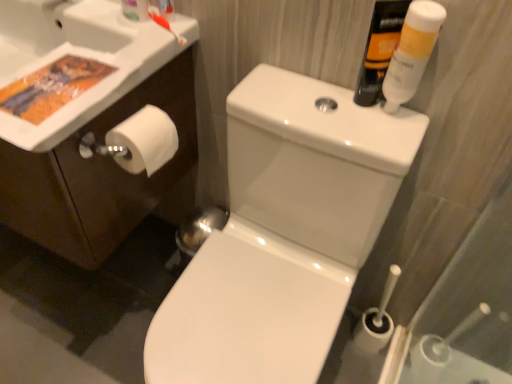
The height and width of the screenshot is (384, 512). I want to click on free space to the left of translucent plastic mouthwash at upper right, the first mouthwash viewed from the left, so click(302, 94).